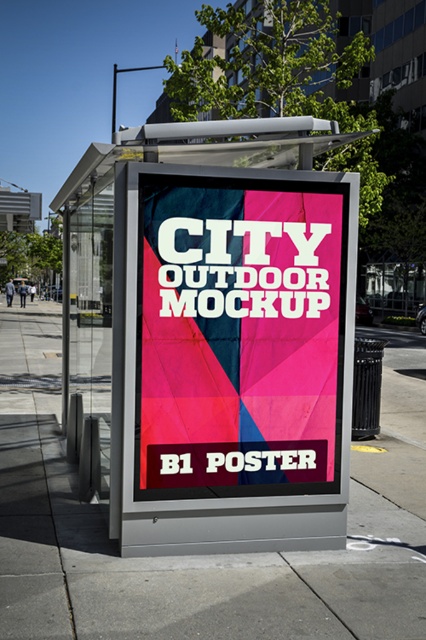
Is metallic silver bus stop at center closer to the viewer compared to matte pink poster at center?

Yes, metallic silver bus stop at center is closer to the viewer.

Does point (127, 422) come in front of point (195, 488)?

Yes.

The width and height of the screenshot is (426, 640). I want to click on metallic silver bus stop at center, so coord(227,333).

Is metallic silver bus stop at center above matte gray pavement at center?

Indeed, metallic silver bus stop at center is positioned over matte gray pavement at center.

This screenshot has height=640, width=426. What are the coordinates of `metallic silver bus stop at center` in the screenshot? It's located at (227, 333).

Looking at this image, does matte pink poster at center have a greater width compared to matte gray pavement at center?

→ Incorrect, matte pink poster at center's width does not surpass matte gray pavement at center's.

Who is taller, matte pink poster at center or matte gray pavement at center?

Standing taller between the two is matte pink poster at center.

Which is in front, point (282, 220) or point (46, 520)?

Point (282, 220) is more forward.

The height and width of the screenshot is (640, 426). Identify the location of matte pink poster at center. (236, 337).